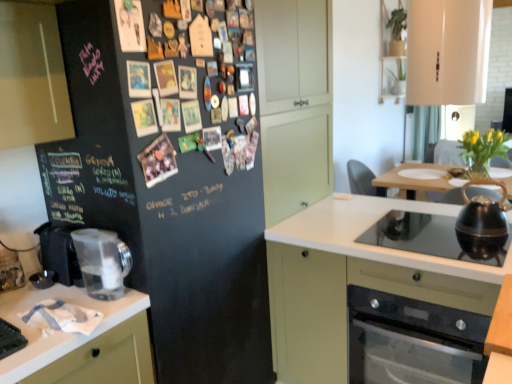
Question: From a real-world perspective, is black matte refrigerator at left positioned over wooden table at lower right based on gravity?

Choices:
 (A) yes
 (B) no

Answer: (A)

Question: Does black matte refrigerator at left have a lesser height compared to wooden table at lower right?

Choices:
 (A) yes
 (B) no

Answer: (B)

Question: Considering the relative positions of black matte refrigerator at left and wooden table at lower right in the image provided, is black matte refrigerator at left behind wooden table at lower right?

Choices:
 (A) yes
 (B) no

Answer: (A)

Question: Does black matte refrigerator at left contain wooden table at lower right?

Choices:
 (A) yes
 (B) no

Answer: (B)

Question: From a real-world perspective, is black matte refrigerator at left positioned under wooden table at lower right based on gravity?

Choices:
 (A) yes
 (B) no

Answer: (B)

Question: Can you confirm if black matte refrigerator at left is wider than wooden table at lower right?

Choices:
 (A) yes
 (B) no

Answer: (A)

Question: Is black glass cooktop at lower right aimed at black matte refrigerator at left?

Choices:
 (A) no
 (B) yes

Answer: (A)

Question: From a real-world perspective, is black glass cooktop at lower right under black matte refrigerator at left?

Choices:
 (A) yes
 (B) no

Answer: (A)

Question: From the image's perspective, is black glass cooktop at lower right on black matte refrigerator at left?

Choices:
 (A) yes
 (B) no

Answer: (B)

Question: Is black glass cooktop at lower right taller than black matte refrigerator at left?

Choices:
 (A) no
 (B) yes

Answer: (A)

Question: Are black glass cooktop at lower right and black matte refrigerator at left located far from each other?

Choices:
 (A) yes
 (B) no

Answer: (B)

Question: Does black glass cooktop at lower right have a lesser height compared to black matte refrigerator at left?

Choices:
 (A) yes
 (B) no

Answer: (A)

Question: Is wooden table at lower right far away from shiny black kettle at right, which ranks as the second kitchen appliance in left-to-right order?

Choices:
 (A) yes
 (B) no

Answer: (B)